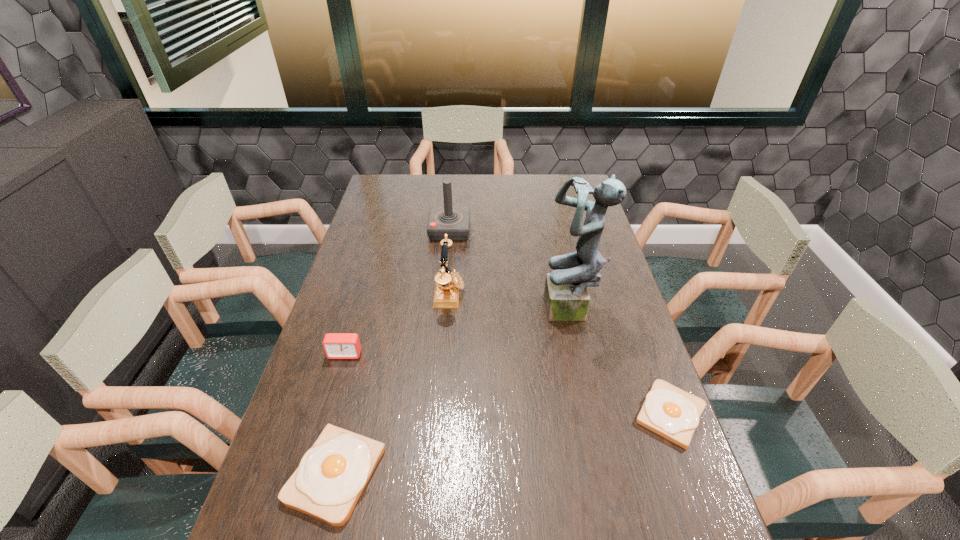
Where is `the third closest object to the fifth tallest object`? This screenshot has height=540, width=960. the third closest object to the fifth tallest object is located at coordinates coord(566,296).

Identify the location of object identified as the third closest to the alarm clock. This screenshot has height=540, width=960. (454, 221).

What are the coordinates of `vacant space that satisfies the following two spatial constraints: 1. on the face of the sculpture; 2. on the left side of the shortest object` in the screenshot? It's located at (593, 414).

The height and width of the screenshot is (540, 960). I want to click on free space in the image that satisfies the following two spatial constraints: 1. on the back side of the shortest object; 2. on the face of the sculpture, so click(x=633, y=311).

Locate an element on the screen. The image size is (960, 540). free space that satisfies the following two spatial constraints: 1. on the rectangular base of the farthest object; 2. on the front-facing side of the third shortest object is located at coordinates (439, 354).

Find the location of `free location that satisfies the following two spatial constraints: 1. on the dial of the telephone; 2. on the right side of the right toast`. free location that satisfies the following two spatial constraints: 1. on the dial of the telephone; 2. on the right side of the right toast is located at coordinates (440, 414).